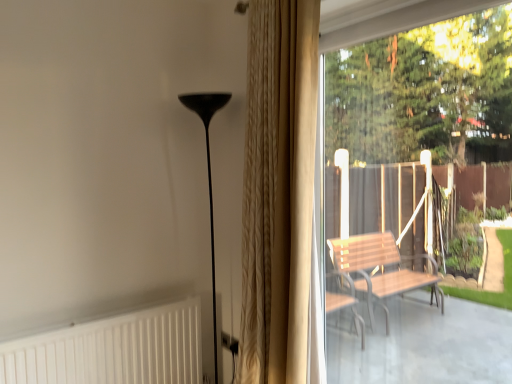
Question: From the image's perspective, is wooden bench at right located beneath beige textured curtain at center?

Choices:
 (A) yes
 (B) no

Answer: (A)

Question: From the image's perspective, is wooden bench at right on beige textured curtain at center?

Choices:
 (A) no
 (B) yes

Answer: (A)

Question: Can you confirm if wooden bench at right is taller than beige textured curtain at center?

Choices:
 (A) no
 (B) yes

Answer: (A)

Question: Is wooden bench at right positioned far away from beige textured curtain at center?

Choices:
 (A) yes
 (B) no

Answer: (A)

Question: Does wooden bench at right have a lesser height compared to beige textured curtain at center?

Choices:
 (A) no
 (B) yes

Answer: (B)

Question: Does wooden bench at right appear on the right side of beige textured curtain at center?

Choices:
 (A) yes
 (B) no

Answer: (A)

Question: Is matte black floor lamp at center to the right of white textured radiator at lower left from the viewer's perspective?

Choices:
 (A) yes
 (B) no

Answer: (A)

Question: Is white textured radiator at lower left at the back of matte black floor lamp at center?

Choices:
 (A) yes
 (B) no

Answer: (B)

Question: Can you confirm if matte black floor lamp at center is bigger than white textured radiator at lower left?

Choices:
 (A) yes
 (B) no

Answer: (A)

Question: Considering the relative sizes of matte black floor lamp at center and white textured radiator at lower left in the image provided, is matte black floor lamp at center smaller than white textured radiator at lower left?

Choices:
 (A) yes
 (B) no

Answer: (B)

Question: Is matte black floor lamp at center thinner than white textured radiator at lower left?

Choices:
 (A) no
 (B) yes

Answer: (A)

Question: Does matte black floor lamp at center have a lesser height compared to white textured radiator at lower left?

Choices:
 (A) yes
 (B) no

Answer: (B)

Question: From a real-world perspective, is matte black floor lamp at center below beige textured curtain at center?

Choices:
 (A) yes
 (B) no

Answer: (A)